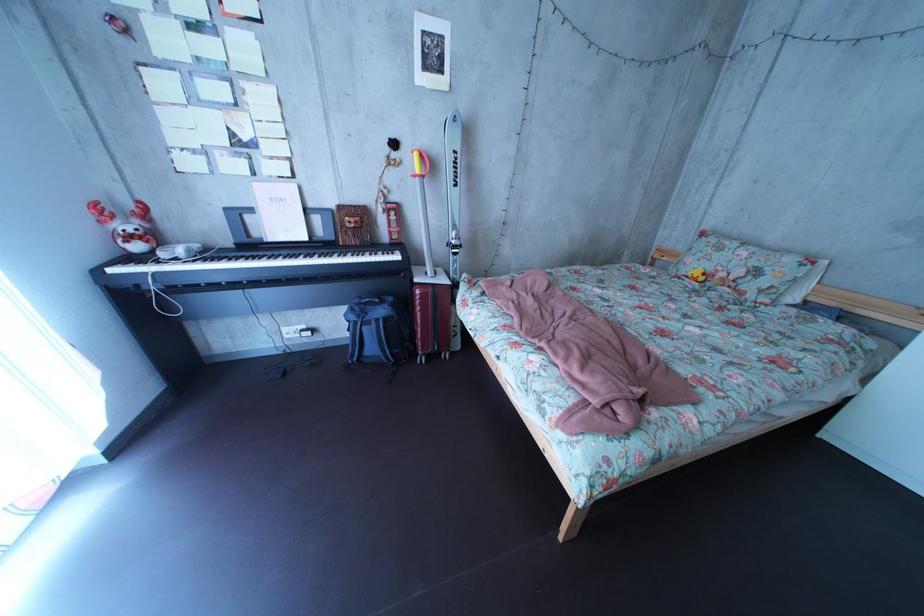
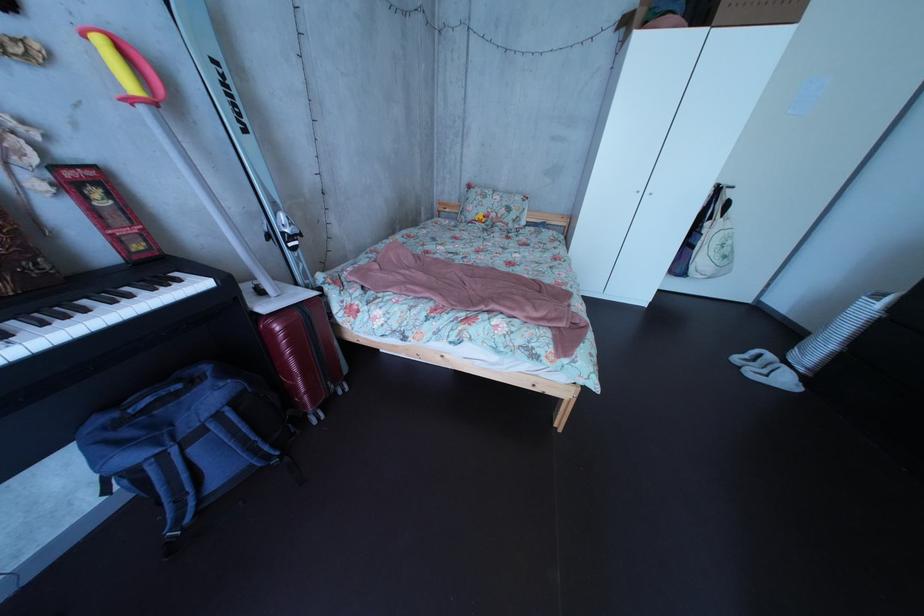
The point at (731, 262) is marked in the first image. Where is the corresponding point in the second image?

(499, 209)